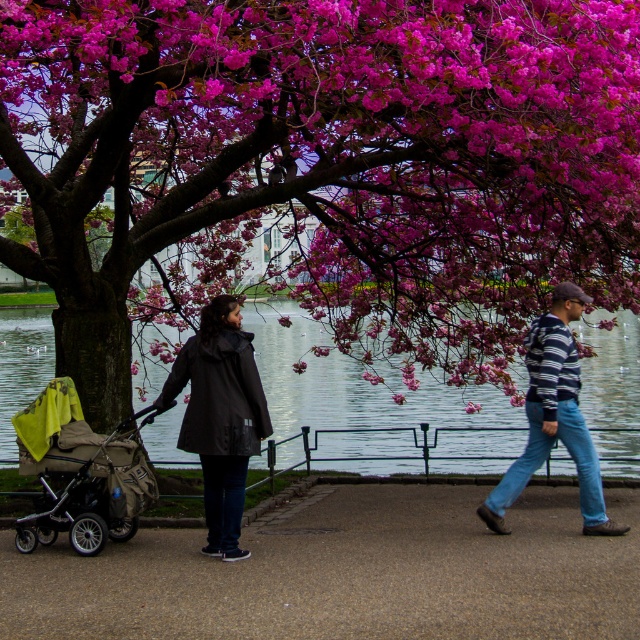
Question: Does matte black coat at center have a smaller size compared to striped sweater at center?

Choices:
 (A) no
 (B) yes

Answer: (B)

Question: Does pink blossom tree at center have a lesser width compared to transparent water at center?

Choices:
 (A) no
 (B) yes

Answer: (B)

Question: Which point appears farthest from the camera in this image?

Choices:
 (A) (90, 269)
 (B) (24, 433)

Answer: (A)

Question: Among these points, which one is nearest to the camera?

Choices:
 (A) (560, 326)
 (B) (122, 472)
 (C) (522, 522)

Answer: (A)

Question: Considering the relative positions of pink blossom tree at center and striped sweater at center in the image provided, where is pink blossom tree at center located with respect to striped sweater at center?

Choices:
 (A) below
 (B) above

Answer: (B)

Question: Which object appears farthest from the camera in this image?

Choices:
 (A) transparent water at center
 (B) concrete sidewalk at center

Answer: (A)